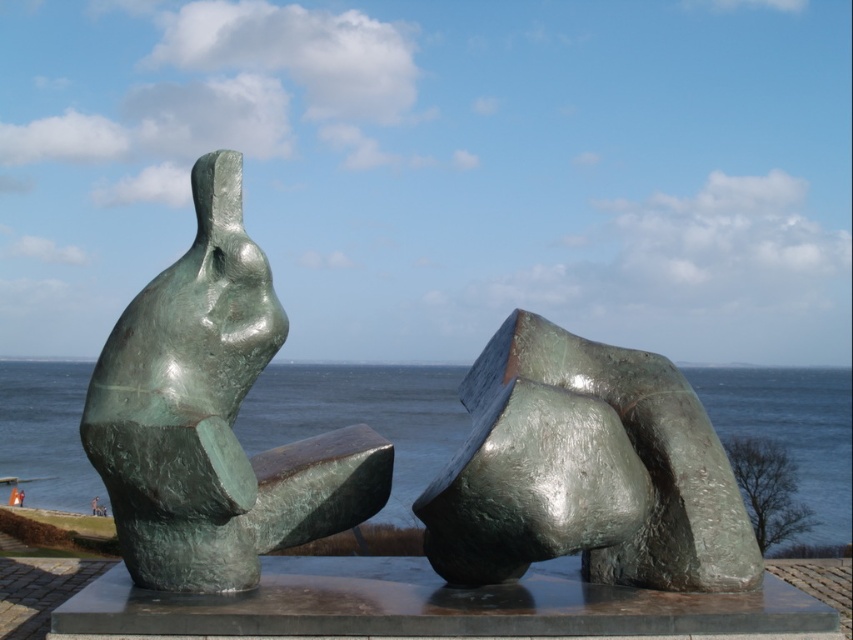
The image size is (853, 640). Describe the element at coordinates (212, 417) in the screenshot. I see `green polished bronze statue at left` at that location.

Who is more forward, (126, 452) or (717, 404)?

Positioned in front is point (126, 452).

Identify the location of green polished bronze statue at left. [212, 417].

Does green polished bronze statue at left have a lesser height compared to green polished stone abstract form at center?

No.

The width and height of the screenshot is (853, 640). Find the location of `green polished bronze statue at left`. green polished bronze statue at left is located at coordinates (212, 417).

This screenshot has height=640, width=853. In order to click on green polished bronze statue at left in this screenshot , I will do `click(212, 417)`.

From the picture: Does green polished stone abstract form at center appear over green metallic water at center?

Indeed, green polished stone abstract form at center is positioned over green metallic water at center.

Based on the photo, how much distance is there between green polished stone abstract form at center and green metallic water at center?

The distance of green polished stone abstract form at center from green metallic water at center is 9.02 feet.

Where is `green polished stone abstract form at center`? green polished stone abstract form at center is located at coordinates (585, 470).

Locate an element on the screen. This screenshot has width=853, height=640. green polished stone abstract form at center is located at coordinates (585, 470).